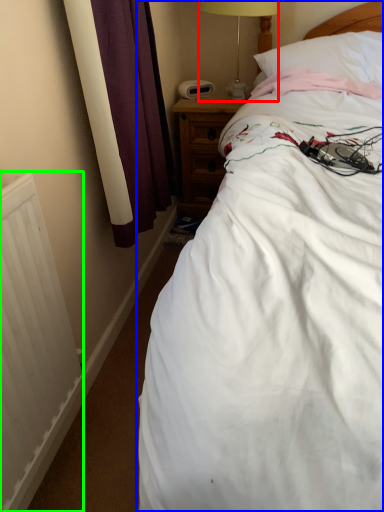
Question: Based on their relative distances, which object is farther from table lamp (highlighted by a red box)? Choose from bed (highlighted by a blue box) and radiator (highlighted by a green box).

Choices:
 (A) bed
 (B) radiator

Answer: (B)